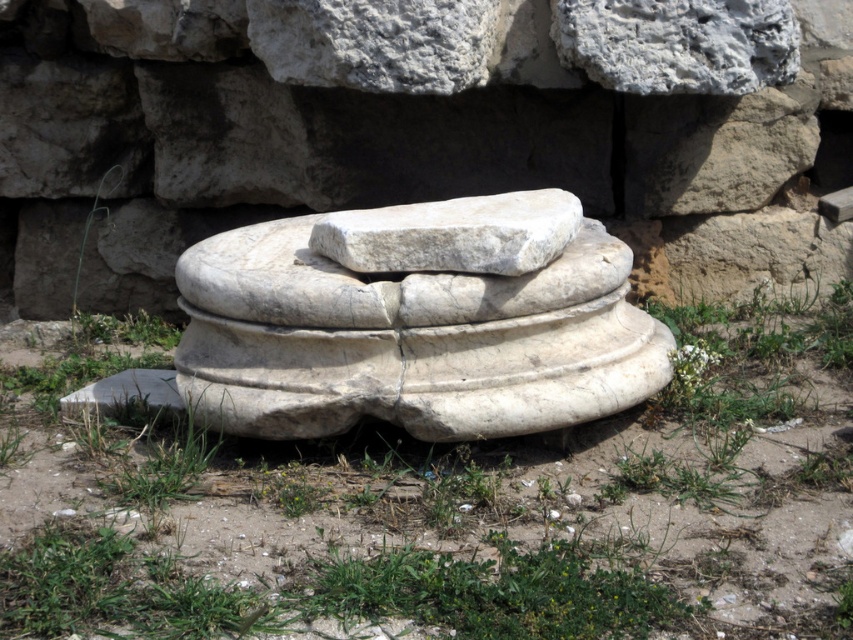
Question: Is green grass at center to the left of white marble sculpture at center from the viewer's perspective?

Choices:
 (A) yes
 (B) no

Answer: (A)

Question: Which object is farther from the camera taking this photo?

Choices:
 (A) green grass at center
 (B) white marble sculpture at center

Answer: (B)

Question: Among these objects, which one is farthest from the camera?

Choices:
 (A) green grass at center
 (B) white marble sculpture at center

Answer: (B)

Question: Among these objects, which one is farthest from the camera?

Choices:
 (A) green grass at center
 (B) white marble sculpture at center

Answer: (B)

Question: Can you confirm if green grass at center is wider than white marble sculpture at center?

Choices:
 (A) no
 (B) yes

Answer: (B)

Question: Can you confirm if green grass at center is positioned below white marble sculpture at center?

Choices:
 (A) yes
 (B) no

Answer: (A)